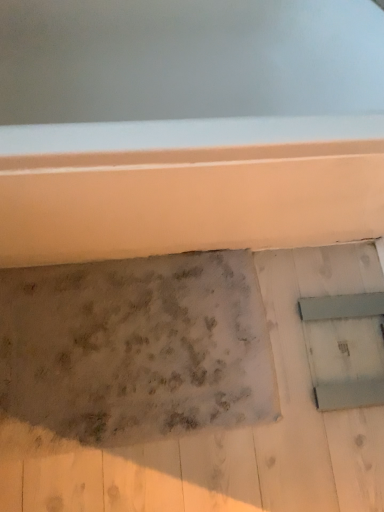
Question: From the image's perspective, is metallic gray window at lower right located beneath speckled concrete wall at center?

Choices:
 (A) no
 (B) yes

Answer: (A)

Question: Considering the relative sizes of metallic gray window at lower right and speckled concrete wall at center in the image provided, is metallic gray window at lower right smaller than speckled concrete wall at center?

Choices:
 (A) no
 (B) yes

Answer: (B)

Question: From a real-world perspective, is metallic gray window at lower right over speckled concrete wall at center?

Choices:
 (A) no
 (B) yes

Answer: (B)

Question: From a real-world perspective, is metallic gray window at lower right positioned under speckled concrete wall at center based on gravity?

Choices:
 (A) yes
 (B) no

Answer: (B)

Question: Is metallic gray window at lower right closer to the viewer compared to speckled concrete wall at center?

Choices:
 (A) no
 (B) yes

Answer: (A)

Question: Does metallic gray window at lower right appear on the left side of speckled concrete wall at center?

Choices:
 (A) yes
 (B) no

Answer: (B)

Question: Is speckled concrete wall at center to the left of metallic gray window at lower right from the viewer's perspective?

Choices:
 (A) no
 (B) yes

Answer: (B)

Question: Is the position of speckled concrete wall at center more distant than that of metallic gray window at lower right?

Choices:
 (A) yes
 (B) no

Answer: (B)

Question: From the image's perspective, would you say speckled concrete wall at center is positioned over metallic gray window at lower right?

Choices:
 (A) no
 (B) yes

Answer: (A)

Question: Is metallic gray window at lower right inside speckled concrete wall at center?

Choices:
 (A) yes
 (B) no

Answer: (A)

Question: From the image's perspective, is speckled concrete wall at center located beneath metallic gray window at lower right?

Choices:
 (A) no
 (B) yes

Answer: (B)

Question: Does speckled concrete wall at center have a lesser width compared to metallic gray window at lower right?

Choices:
 (A) yes
 (B) no

Answer: (B)

Question: Does point (8, 379) appear closer or farther from the camera than point (311, 321)?

Choices:
 (A) farther
 (B) closer

Answer: (B)